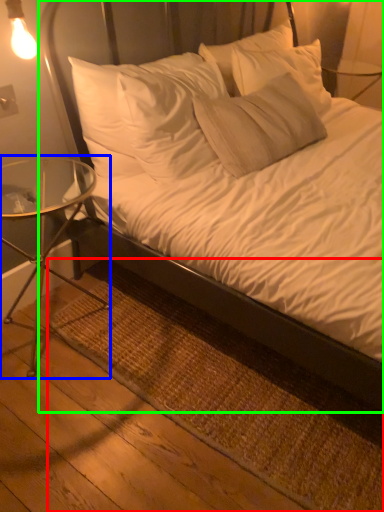
Question: Which is farther away from mat (highlighted by a red box)? table (highlighted by a blue box) or bed (highlighted by a green box)?

Choices:
 (A) table
 (B) bed

Answer: (A)